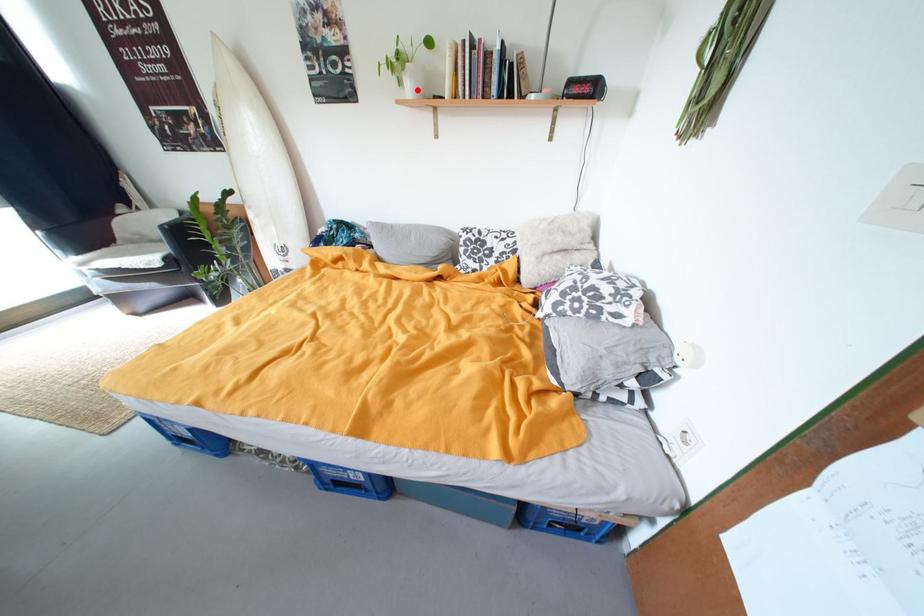
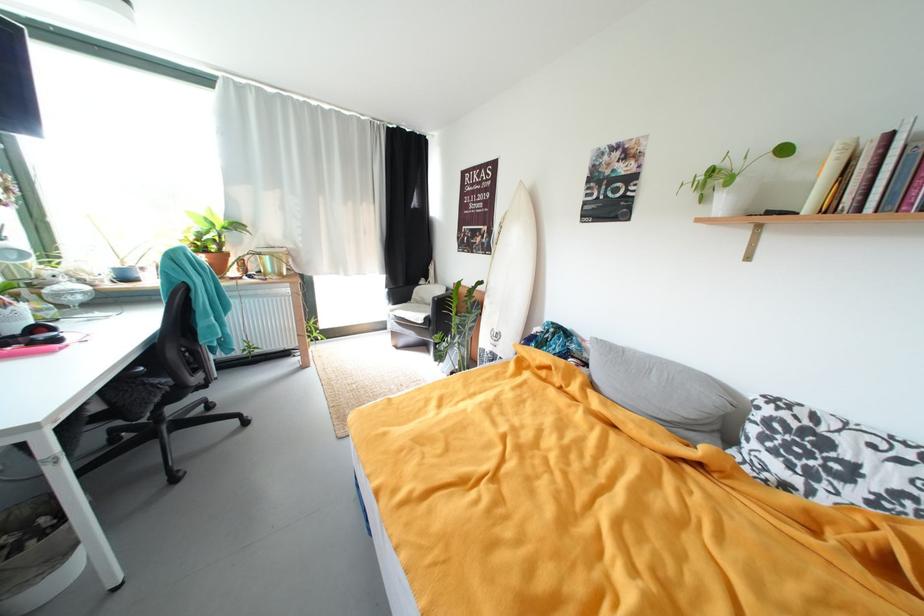
Find the pixel in the second image that matches the highlighted location in the first image.

(730, 206)